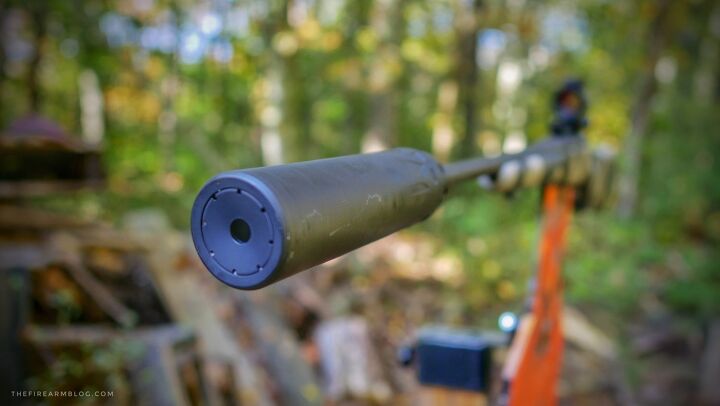
Image resolution: width=720 pixels, height=406 pixels. I want to click on devices, so click(x=361, y=188), click(x=446, y=354).